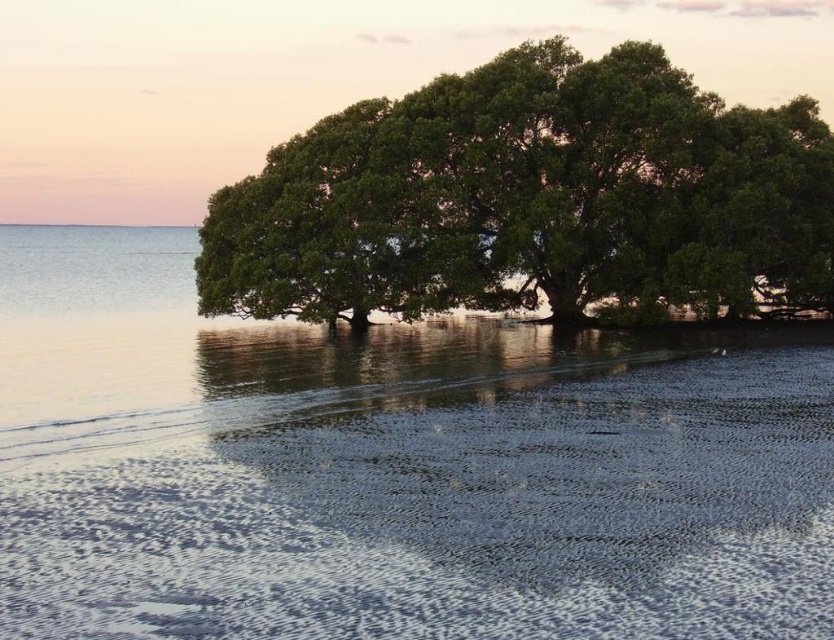
In the scene shown: You are standing on the smooth sand at lower center and want to look up to see the green leafy tree at center. In which direction should you look?

You should look upward because the smooth sand at lower center is positioned under the green leafy tree at center.

You are standing at the center of the image and want to walk towards the smooth sand at lower center. Which direction should you move?

The smooth sand at lower center is located at coordinates approximately 0.812 on the x axis and 0.547 on the y axis. Since you are at the center, you should move towards the lower right direction to reach it.